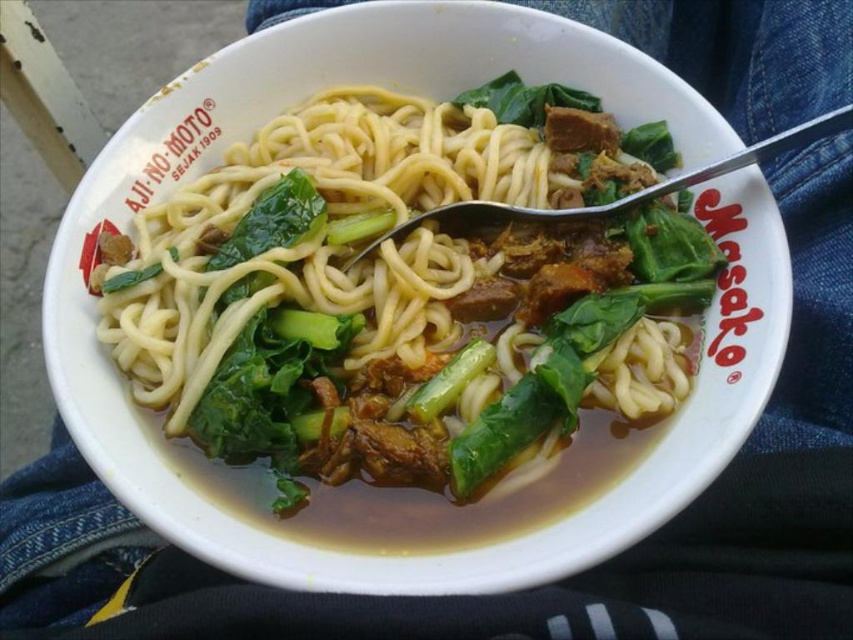
Is point (357, 461) positioned after point (485, 100)?

No, (357, 461) is closer to viewer.

Where is `yellow matte noodles at center`? yellow matte noodles at center is located at coordinates (402, 296).

Image resolution: width=853 pixels, height=640 pixels. I want to click on yellow matte noodles at center, so click(402, 296).

You are a GUI agent. You are given a task and a screenshot of the screen. Output one action in this format:
    pyautogui.click(x=<x>, y=<y>)
    Task: Click on the yellow matte noodles at center
    
    Given the screenshot: What is the action you would take?
    pyautogui.click(x=402, y=296)